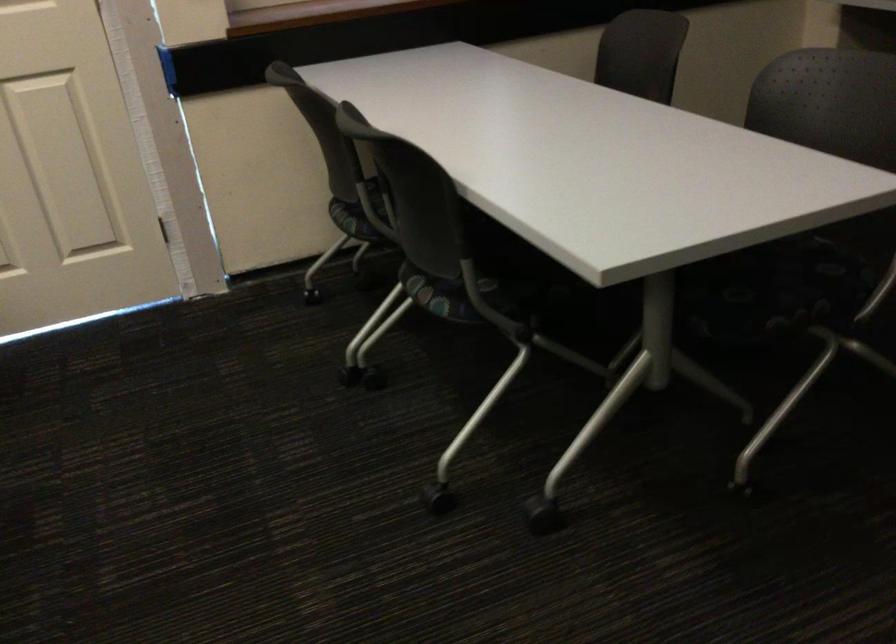
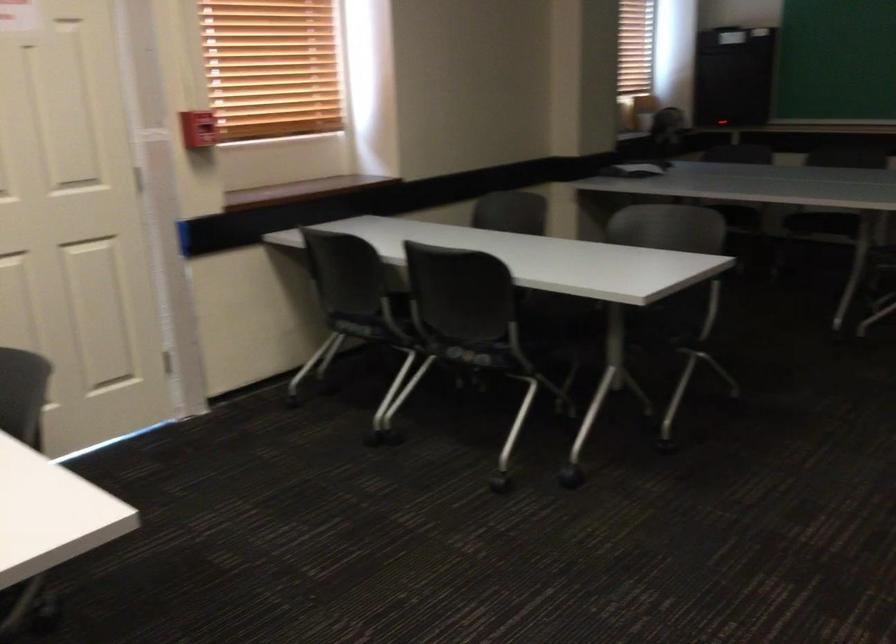
The point at (360, 219) is marked in the first image. Where is the corresponding point in the second image?

(360, 328)